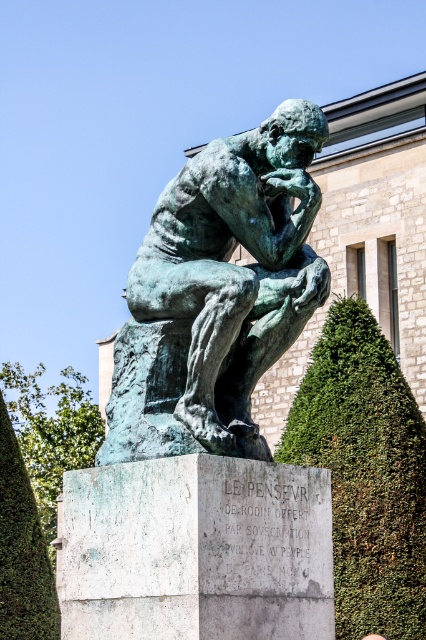
Is the position of green patina statue at center more distant than that of green leafy hedge at lower left?

No.

At what (x,y) coordinates should I click in order to perform the action: click on green patina statue at center. Please return your answer as a coordinate pair (x, y). Looking at the image, I should click on (218, 292).

Does point (262, 253) come in front of point (5, 444)?

Yes, point (262, 253) is in front of point (5, 444).

Identify the location of green patina statue at center. (218, 292).

Can you confirm if green textured hedge at center right is taller than green leafy hedge at lower left?

Indeed, green textured hedge at center right has a greater height compared to green leafy hedge at lower left.

Image resolution: width=426 pixels, height=640 pixels. Find the location of `green textured hedge at center right`. green textured hedge at center right is located at coordinates (365, 472).

Locate an element on the screen. Image resolution: width=426 pixels, height=640 pixels. green textured hedge at center right is located at coordinates (365, 472).

Between green patina statue at center and green textured hedge at center right, which one is positioned higher?

green patina statue at center is above.

What do you see at coordinates (218, 292) in the screenshot?
I see `green patina statue at center` at bounding box center [218, 292].

The width and height of the screenshot is (426, 640). In order to click on green patina statue at center in this screenshot , I will do `click(218, 292)`.